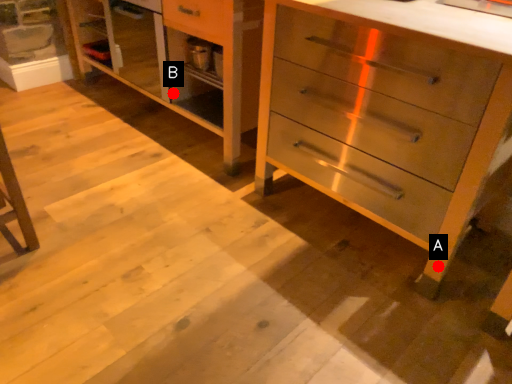
Question: Two points are circled on the image, labeled by A and B beside each circle. Among these points, which one is farthest from the camera?

Choices:
 (A) A is further
 (B) B is further

Answer: (B)